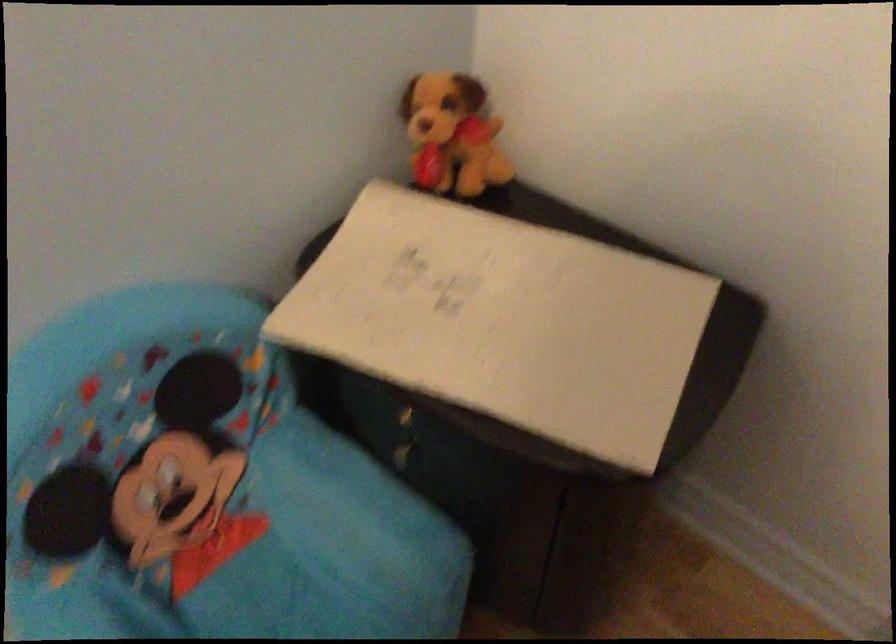
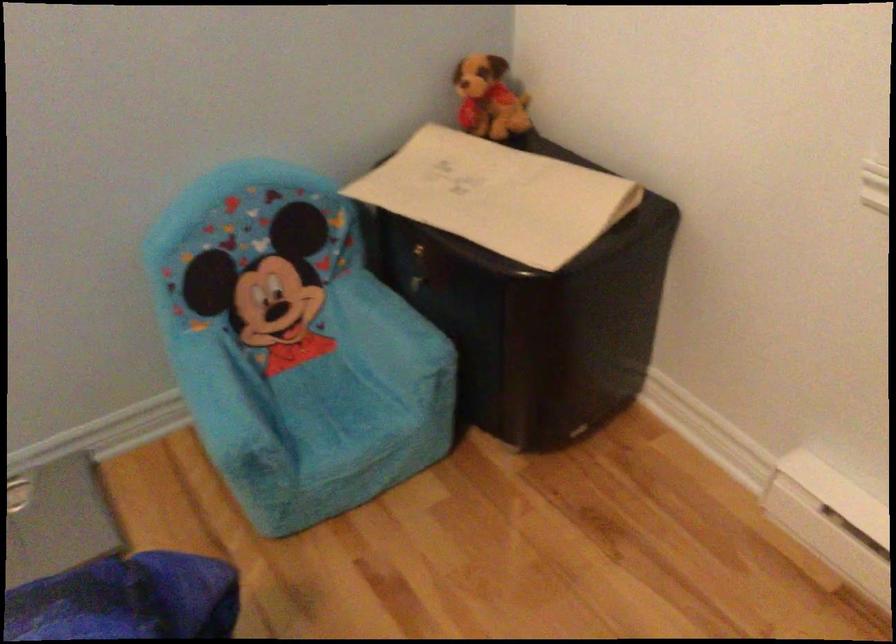
Where in the second image is the point corresponding to pixel 455 145 from the first image?

(488, 99)